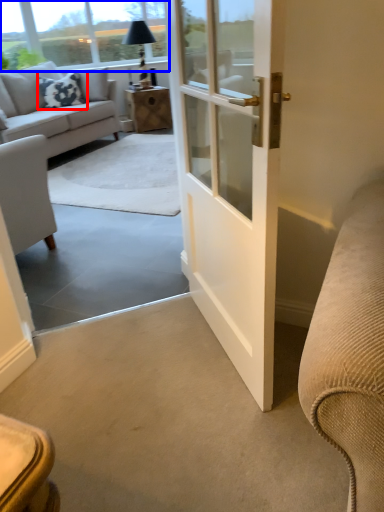
Question: Which of the following is the closest to the observer, pillow (highlighted by a red box) or window screen (highlighted by a blue box)?

Choices:
 (A) pillow
 (B) window screen

Answer: (A)